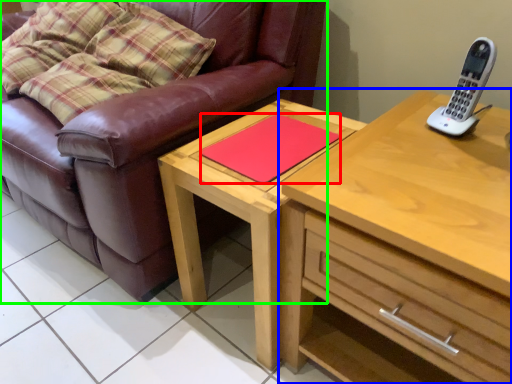
Question: Estimate the real-world distances between objects in this image. Which object is closer to pad (highlighted by a red box), chest of drawers (highlighted by a blue box) or studio couch (highlighted by a green box)?

Choices:
 (A) chest of drawers
 (B) studio couch

Answer: (A)